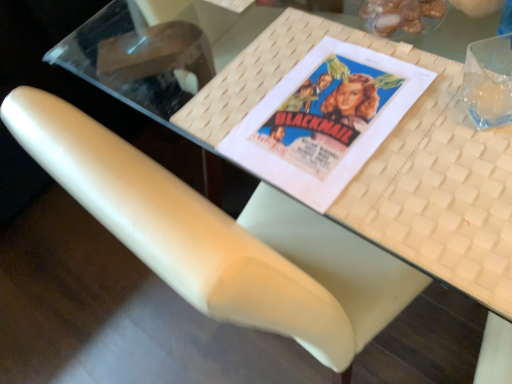
Question: From a real-world perspective, does matte paper movie poster at center stand above white woven placemat at upper center?

Choices:
 (A) no
 (B) yes

Answer: (B)

Question: Is matte paper movie poster at center positioned before white woven placemat at upper center?

Choices:
 (A) yes
 (B) no

Answer: (B)

Question: Can we say matte paper movie poster at center lies outside white woven placemat at upper center?

Choices:
 (A) no
 (B) yes

Answer: (A)

Question: Considering the relative sizes of matte paper movie poster at center and white woven placemat at upper center in the image provided, is matte paper movie poster at center thinner than white woven placemat at upper center?

Choices:
 (A) no
 (B) yes

Answer: (B)

Question: From the image's perspective, is matte paper movie poster at center on top of white woven placemat at upper center?

Choices:
 (A) yes
 (B) no

Answer: (A)

Question: Visually, is white woven placemat at upper center positioned to the left or to the right of shiny brown nuts at upper right?

Choices:
 (A) left
 (B) right

Answer: (A)

Question: From a real-world perspective, is white woven placemat at upper center physically located above or below shiny brown nuts at upper right?

Choices:
 (A) below
 (B) above

Answer: (A)

Question: Is white woven placemat at upper center situated inside shiny brown nuts at upper right or outside?

Choices:
 (A) inside
 (B) outside

Answer: (B)

Question: Considering their positions, is white woven placemat at upper center located in front of or behind shiny brown nuts at upper right?

Choices:
 (A) front
 (B) behind

Answer: (A)

Question: Considering the positions of matte paper movie poster at center and white woven placemat at upper center in the image, is matte paper movie poster at center taller or shorter than white woven placemat at upper center?

Choices:
 (A) short
 (B) tall

Answer: (A)

Question: Based on their sizes in the image, would you say matte paper movie poster at center is bigger or smaller than white woven placemat at upper center?

Choices:
 (A) big
 (B) small

Answer: (B)

Question: Looking at their shapes, would you say matte paper movie poster at center is wider or thinner than white woven placemat at upper center?

Choices:
 (A) thin
 (B) wide

Answer: (A)

Question: Is matte paper movie poster at center spatially inside white woven placemat at upper center, or outside of it?

Choices:
 (A) outside
 (B) inside

Answer: (B)

Question: From the image's perspective, is white leather chair at center positioned above or below shiny brown nuts at upper right?

Choices:
 (A) above
 (B) below

Answer: (B)

Question: Is white leather chair at center wider or thinner than shiny brown nuts at upper right?

Choices:
 (A) thin
 (B) wide

Answer: (B)